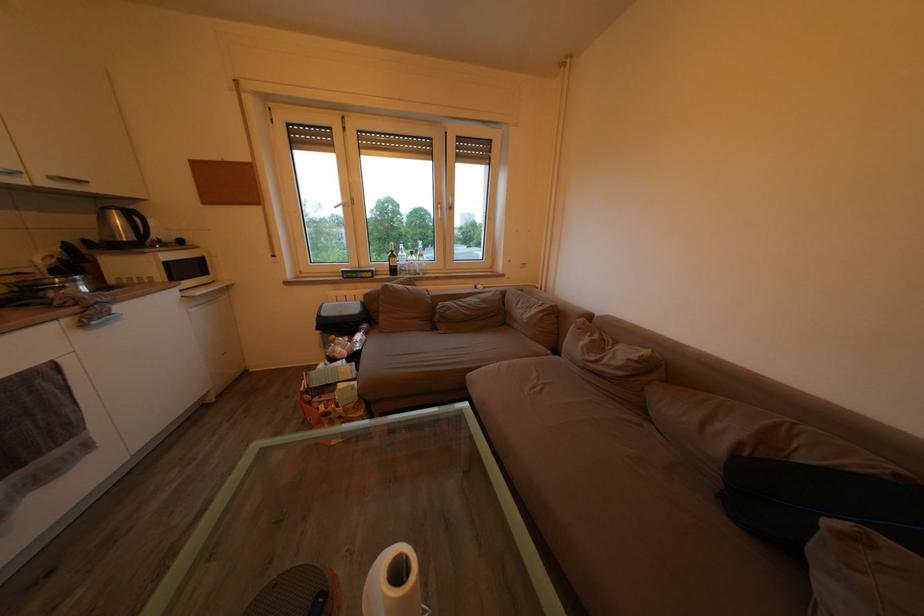
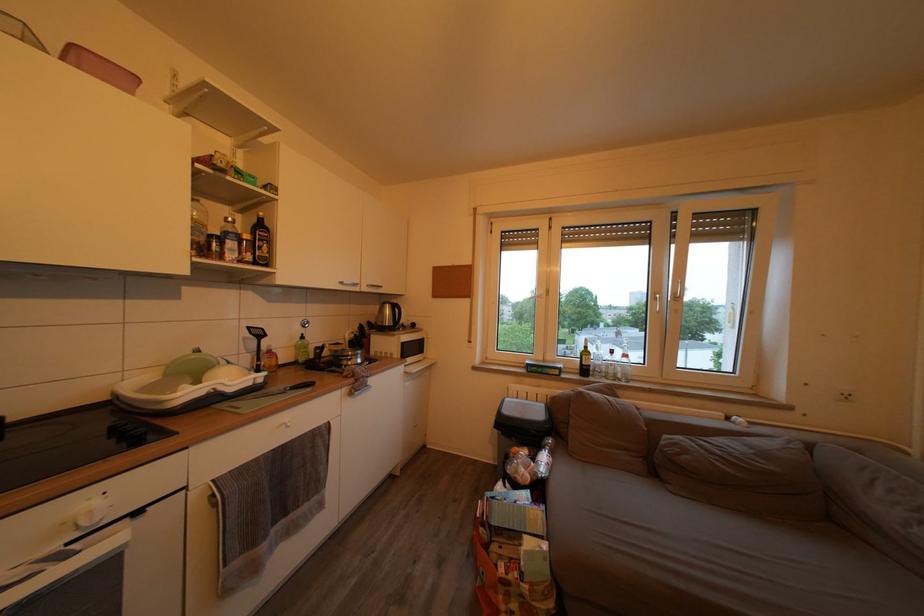
The point at (74, 326) is marked in the first image. Where is the corresponding point in the second image?

(351, 395)